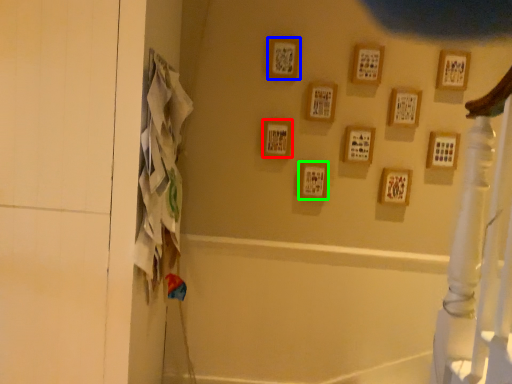
Question: Estimate the real-world distances between objects in this image. Which object is farther from picture frame (highlighted by a red box), picture frame (highlighted by a blue box) or picture frame (highlighted by a green box)?

Choices:
 (A) picture frame
 (B) picture frame

Answer: (A)